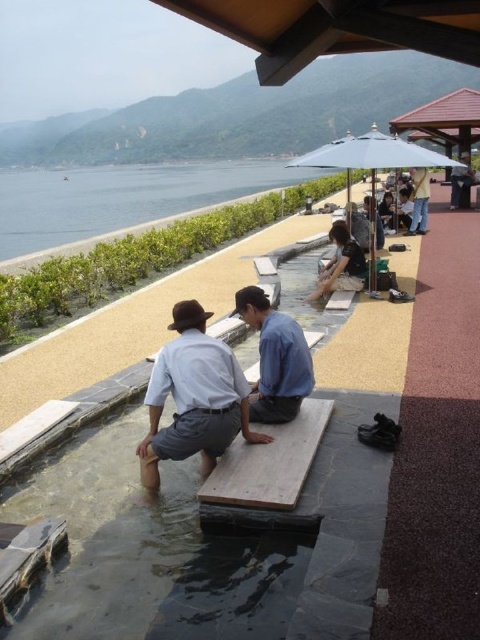
Question: Which of the following is the closest to the observer?

Choices:
 (A) light blue shirt at center
 (B) blue cotton shirt at center
 (C) matte blue umbrella at upper right

Answer: (A)

Question: From the image, what is the correct spatial relationship of clear water at lower left in relation to light brown wooden bench at upper right?

Choices:
 (A) right
 (B) left

Answer: (B)

Question: Which point is farther to the camera?

Choices:
 (A) clear water at lower left
 (B) blue cotton shirt at center
 (C) matte blue umbrella at upper right
 (D) light brown wooden bench at upper right

Answer: (A)

Question: Is the position of light blue shirt at center more distant than that of light blue fabric umbrella at upper center?

Choices:
 (A) yes
 (B) no

Answer: (B)

Question: Which of the following is the farthest from the observer?

Choices:
 (A) (372, 186)
 (B) (274, 332)

Answer: (A)

Question: Is light blue shirt at center wider than light blue fabric umbrella at upper center?

Choices:
 (A) yes
 (B) no

Answer: (A)